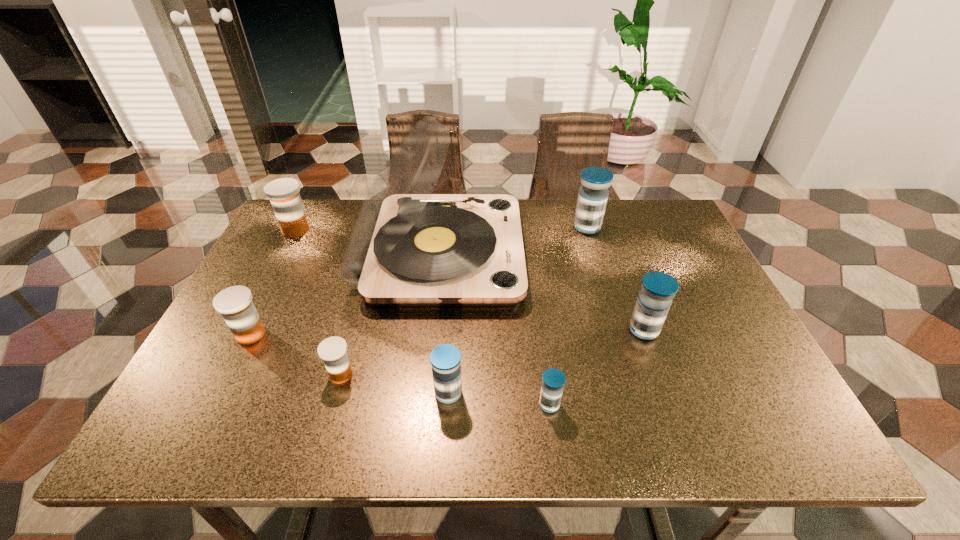
In order to click on record player located at the far edge in this screenshot , I will do `click(409, 247)`.

Find the location of `object located at the far left corner`. object located at the far left corner is located at coordinates (284, 195).

In the image, there is a desktop. In order to click on free space at the far edge in this screenshot , I will do `click(339, 214)`.

Identify the location of vacant point at the near edge. (417, 426).

Where is `vacant space at the left edge of the desktop`? This screenshot has width=960, height=540. vacant space at the left edge of the desktop is located at coordinates click(x=290, y=249).

Where is `vacant space at the right edge of the desktop`? The image size is (960, 540). vacant space at the right edge of the desktop is located at coordinates (717, 348).

In the image, there is a desktop. Where is `free space at the far left corner`? This screenshot has height=540, width=960. free space at the far left corner is located at coordinates (324, 225).

Where is `blank region between the second smallest blue medicine and the biggest orange medicine`? This screenshot has height=540, width=960. blank region between the second smallest blue medicine and the biggest orange medicine is located at coordinates (372, 312).

At what (x,y) coordinates should I click in order to perform the action: click on free spot between the farthest orange medicine and the third biggest blue medicine. Please return your answer as a coordinate pair (x, y). The width and height of the screenshot is (960, 540). Looking at the image, I should click on (372, 312).

In order to click on vacant space in between the fifth medicine from right to left and the biggest orange medicine in this screenshot , I will do `click(319, 302)`.